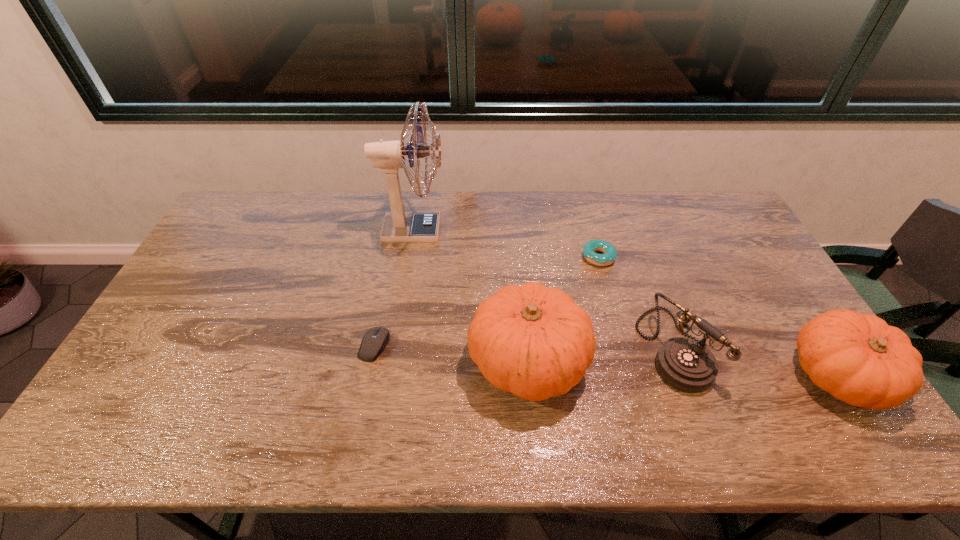
Locate an element on the screen. free space that satisfies the following two spatial constraints: 1. on the front-facing side of the shorter pumpkin; 2. on the right side of the tallest object is located at coordinates (390, 376).

At what (x,y) coordinates should I click in order to perform the action: click on vacant point that satisfies the following two spatial constraints: 1. on the front-facing side of the fan; 2. on the right side of the taller pumpkin. Please return your answer as a coordinate pair (x, y). Looking at the image, I should click on (393, 361).

Where is `blank area in the image that satisfies the following two spatial constraints: 1. on the front-facing side of the rightmost object; 2. on the left side of the tallest object`? This screenshot has width=960, height=540. blank area in the image that satisfies the following two spatial constraints: 1. on the front-facing side of the rightmost object; 2. on the left side of the tallest object is located at coordinates (390, 376).

Identify the location of free point that satisfies the following two spatial constraints: 1. on the front-facing side of the tallest object; 2. on the left side of the right pumpkin. This screenshot has width=960, height=540. (390, 376).

Identify the location of free space that satisfies the following two spatial constraints: 1. on the front-facing side of the telephone; 2. on the left side of the tallest object. The image size is (960, 540). (395, 347).

Locate an element on the screen. Image resolution: width=960 pixels, height=540 pixels. vacant space that satisfies the following two spatial constraints: 1. on the back side of the telephone; 2. on the front-facing side of the tallest object is located at coordinates (631, 230).

The width and height of the screenshot is (960, 540). What are the coordinates of `vacant space that satisfies the following two spatial constraints: 1. on the front-facing side of the right pumpkin; 2. on the right side of the tallest object` in the screenshot? It's located at (390, 376).

Image resolution: width=960 pixels, height=540 pixels. Identify the location of vacant region that satisfies the following two spatial constraints: 1. on the front-facing side of the fan; 2. on the left side of the telephone. (395, 347).

Where is `free space in the image that satisfies the following two spatial constraints: 1. on the front-facing side of the fan; 2. on the right side of the fourth object from right to left`? free space in the image that satisfies the following two spatial constraints: 1. on the front-facing side of the fan; 2. on the right side of the fourth object from right to left is located at coordinates (393, 361).

Identify the location of vacant space that satisfies the following two spatial constraints: 1. on the front-facing side of the shorter pumpkin; 2. on the right side of the tallest object. coord(390,376).